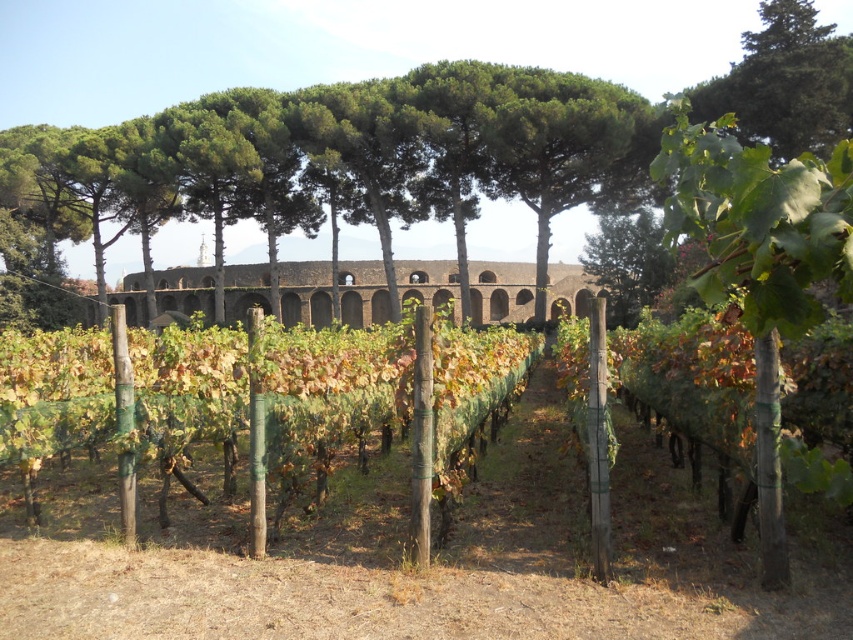
Question: Does green leafy vine at right appear on the right side of brown stone viaduct at center?

Choices:
 (A) no
 (B) yes

Answer: (B)

Question: Can you confirm if green leafy vine at right is positioned to the left of brown stone viaduct at center?

Choices:
 (A) no
 (B) yes

Answer: (A)

Question: Which of the following is the farthest from the observer?

Choices:
 (A) (706, 262)
 (B) (322, 323)

Answer: (B)

Question: Which point is closer to the camera taking this photo?

Choices:
 (A) (525, 300)
 (B) (730, 131)

Answer: (B)

Question: Can you confirm if green leafy vine at right is positioned to the right of brown stone viaduct at center?

Choices:
 (A) yes
 (B) no

Answer: (A)